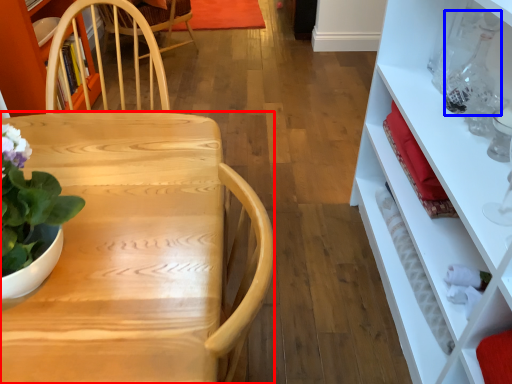
Question: Among these objects, which one is nearest to the camera, desk (highlighted by a red box) or bottle (highlighted by a blue box)?

Choices:
 (A) desk
 (B) bottle

Answer: (A)